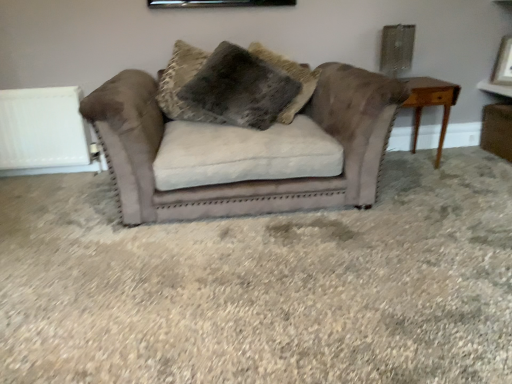
You are a GUI agent. You are given a task and a screenshot of the screen. Output one action in this format:
    pyautogui.click(x=<x>, y=<y>)
    Task: Click on the vacant area that is in front of suede couch at center
    The height and width of the screenshot is (384, 512).
    Given the screenshot: What is the action you would take?
    pyautogui.click(x=251, y=286)